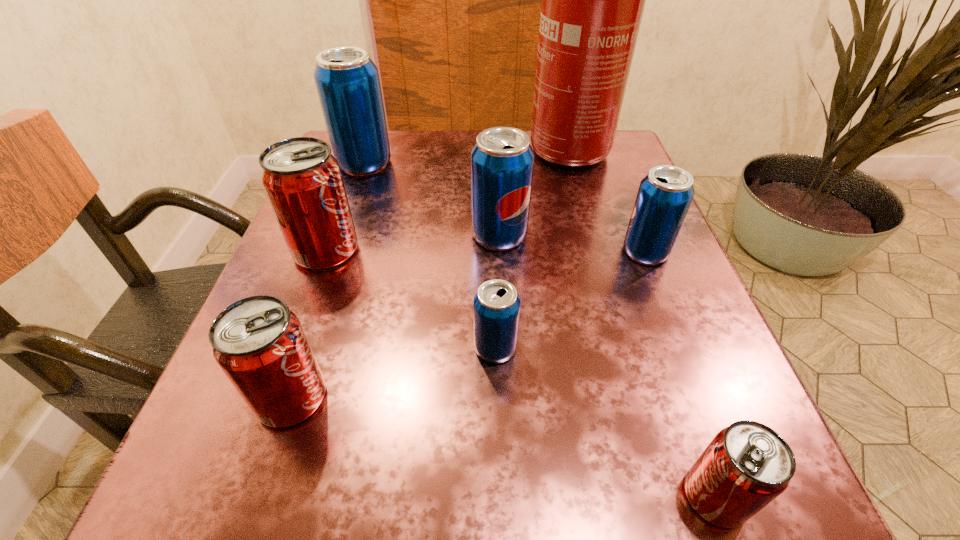
The image size is (960, 540). I want to click on vacant position at the far edge of the desktop, so click(444, 143).

The image size is (960, 540). Find the location of `free region at the left edge`. free region at the left edge is located at coordinates (386, 187).

Image resolution: width=960 pixels, height=540 pixels. Find the location of `vacant area at the right edge`. vacant area at the right edge is located at coordinates (578, 222).

Identify the location of vacant space at the far left corner of the desktop. (372, 182).

The image size is (960, 540). Find the location of `vacant space at the near left corner of the desktop`. vacant space at the near left corner of the desktop is located at coordinates (315, 477).

Image resolution: width=960 pixels, height=540 pixels. What are the coordinates of `blank space at the far right corner` in the screenshot? It's located at (623, 143).

Locate an element on the screen. free region at the near right corner of the desktop is located at coordinates (642, 480).

I want to click on unoccupied area between the third smallest blue pop soda and the rightmost blue pop soda, so click(572, 243).

Locate an element on the screen. free space between the third smallest blue pop soda and the farthest pop soda is located at coordinates (432, 199).

This screenshot has height=540, width=960. I want to click on vacant area that lies between the red fire extinguisher and the sixth farthest pop soda, so click(x=424, y=275).